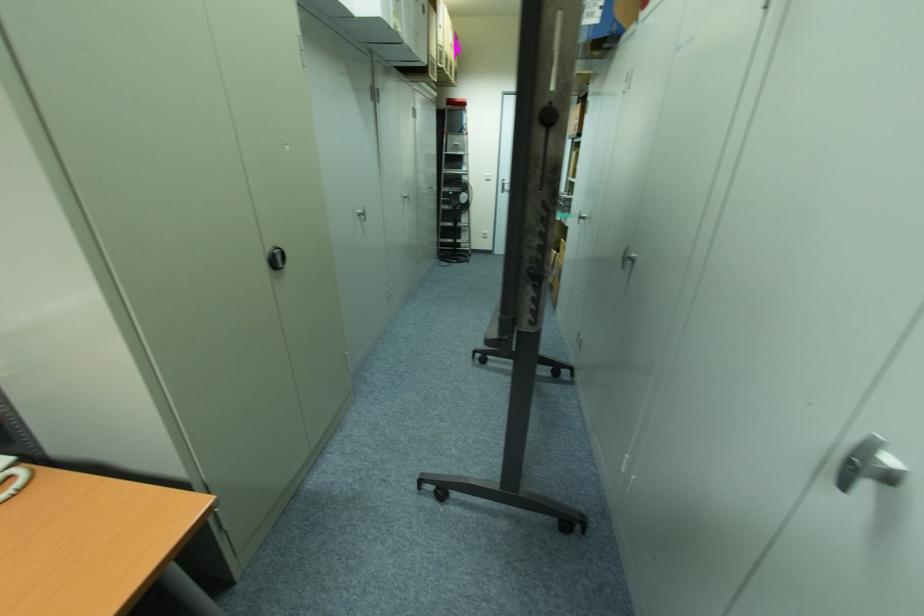
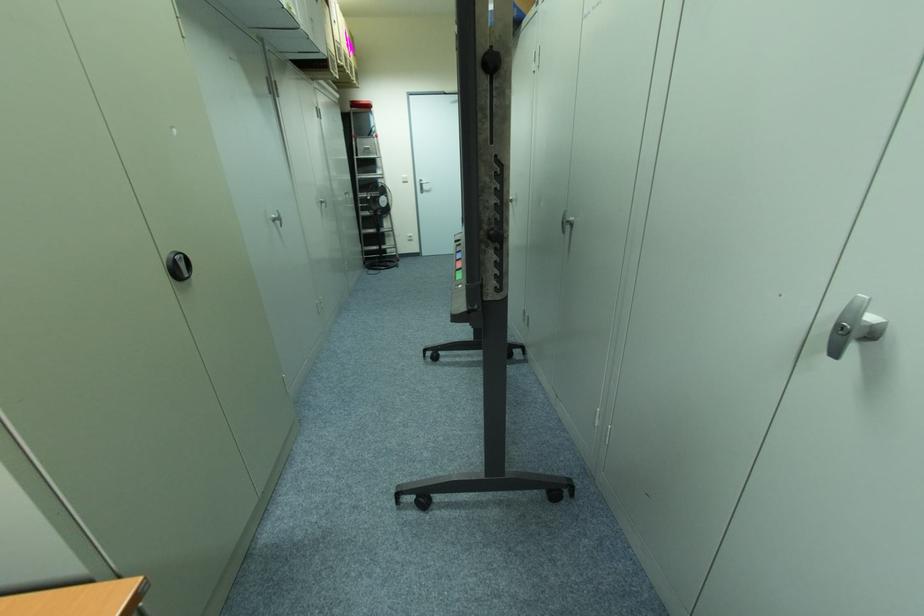
Question: The first image is from the beginning of the video and the second image is from the end. How did the camera likely rotate when shooting the video?

Choices:
 (A) Left
 (B) Right
 (C) Up
 (D) Down

Answer: (B)